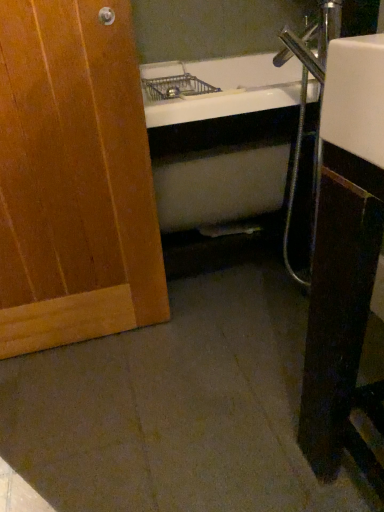
Where is `vacant space in wooden door at left (from a real-world perspective)`? Image resolution: width=384 pixels, height=512 pixels. vacant space in wooden door at left (from a real-world perspective) is located at coordinates (94, 345).